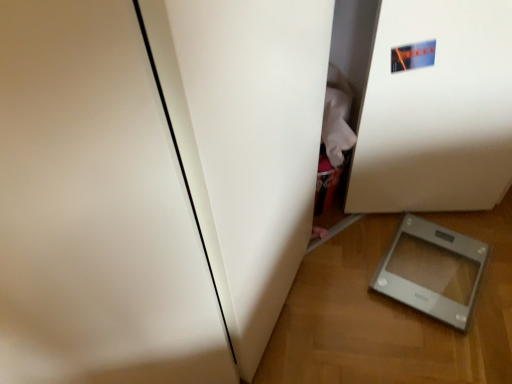
Where is `vacant position to the left of silver plastic scale at lower right`? This screenshot has width=512, height=384. vacant position to the left of silver plastic scale at lower right is located at coordinates (344, 285).